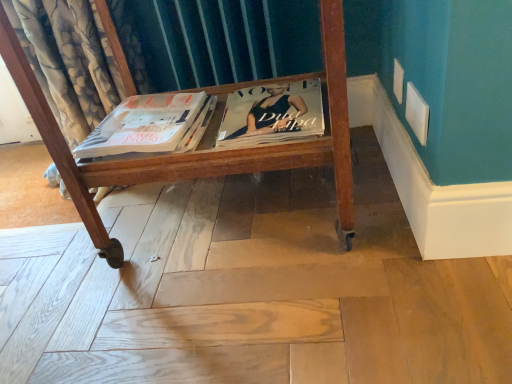
The height and width of the screenshot is (384, 512). I want to click on matte white magazine at center, so click(x=145, y=125).

Image resolution: width=512 pixels, height=384 pixels. In order to click on matte white magazine at center in this screenshot , I will do `click(145, 125)`.

How much distance is there between matte white magazine at center and wooden cart at center?

5.13 inches.

Does matte white magazine at center have a greater height compared to wooden cart at center?

No, matte white magazine at center is not taller than wooden cart at center.

Between matte white magazine at center and wooden cart at center, which one appears on the right side from the viewer's perspective?

From the viewer's perspective, wooden cart at center appears more on the right side.

From a real-world perspective, is matte white magazine at center under wooden cart at center?

Indeed, from a real-world perspective, matte white magazine at center is positioned beneath wooden cart at center.

Find the location of a particular element. The image size is (512, 384). person directly beneath the wooden cart at center (from a real-world perspective) is located at coordinates (272, 113).

From the picture: Does matte black magazine at center have a greater width compared to wooden cart at center?

In fact, matte black magazine at center might be narrower than wooden cart at center.

Considering the relative positions of matte black magazine at center and wooden cart at center in the image provided, is matte black magazine at center behind wooden cart at center?

Yes, it is.

In the scene shown: Does wooden cart at center have a larger size compared to matte white magazine at center?

Indeed, wooden cart at center has a larger size compared to matte white magazine at center.

From the image's perspective, is wooden cart at center over matte white magazine at center?

Yes, from the image's perspective, wooden cart at center is above matte white magazine at center.

Identify the location of person that appears on the right of wooden cart at center. Image resolution: width=512 pixels, height=384 pixels. (272, 113).

Measure the distance between wooden cart at center and matte black magazine at center.

wooden cart at center and matte black magazine at center are 7.18 inches apart from each other.

Is matte black magazine at center inside wooden cart at center?

Yes, matte black magazine at center is a part of wooden cart at center.

From the image's perspective, which is above, wooden cart at center or matte black magazine at center?

matte black magazine at center.

Considering the points (269, 110) and (147, 135), which point is behind, point (269, 110) or point (147, 135)?

Point (269, 110)

Considering the relative positions of matte black magazine at center and matte white magazine at center in the image provided, is matte black magazine at center to the left of matte white magazine at center from the viewer's perspective?

No.

What's the angular difference between matte black magazine at center and matte white magazine at center's facing directions?

They differ by 3.19 degrees in their facing directions.

Does matte black magazine at center have a greater height compared to matte white magazine at center?

Indeed, matte black magazine at center has a greater height compared to matte white magazine at center.

Is matte white magazine at center closer to camera compared to matte black magazine at center?

No.

Does point (167, 112) appear closer or farther from the camera than point (246, 127)?

Point (167, 112) appears to be farther away from the viewer than point (246, 127).

You are a GUI agent. You are given a task and a screenshot of the screen. Output one action in this format:
    pyautogui.click(x=<x>, y=<y>)
    Task: Click on the person in front of the matte white magazine at center
    
    Given the screenshot: What is the action you would take?
    pyautogui.click(x=272, y=113)

This screenshot has height=384, width=512. I want to click on book on the left of wooden cart at center, so click(x=145, y=125).

Identify the location of person above the wooden cart at center (from the image's perspective). This screenshot has width=512, height=384. (272, 113).

Consider the image. Looking at the image, which one is located further to matte white magazine at center, matte black magazine at center or wooden cart at center?

The object further to matte white magazine at center is matte black magazine at center.

From the image, which object appears to be farther from matte black magazine at center, wooden cart at center or matte white magazine at center?

The object further to matte black magazine at center is matte white magazine at center.

Which object lies further to the anchor point matte black magazine at center, matte white magazine at center or wooden cart at center?

matte white magazine at center is positioned further to the anchor matte black magazine at center.

Looking at the image, which one is located further to wooden cart at center, matte black magazine at center or matte white magazine at center?

The object further to wooden cart at center is matte black magazine at center.

Estimate the real-world distances between objects in this image. Which object is closer to matte white magazine at center, wooden cart at center or matte black magazine at center?

wooden cart at center.

Looking at the image, which one is located further to wooden cart at center, matte white magazine at center or matte black magazine at center?

Based on the image, matte black magazine at center appears to be further to wooden cart at center.

The image size is (512, 384). Find the location of `furniture located between matte white magazine at center and matte black magazine at center in the left-right direction`. furniture located between matte white magazine at center and matte black magazine at center in the left-right direction is located at coordinates (203, 141).